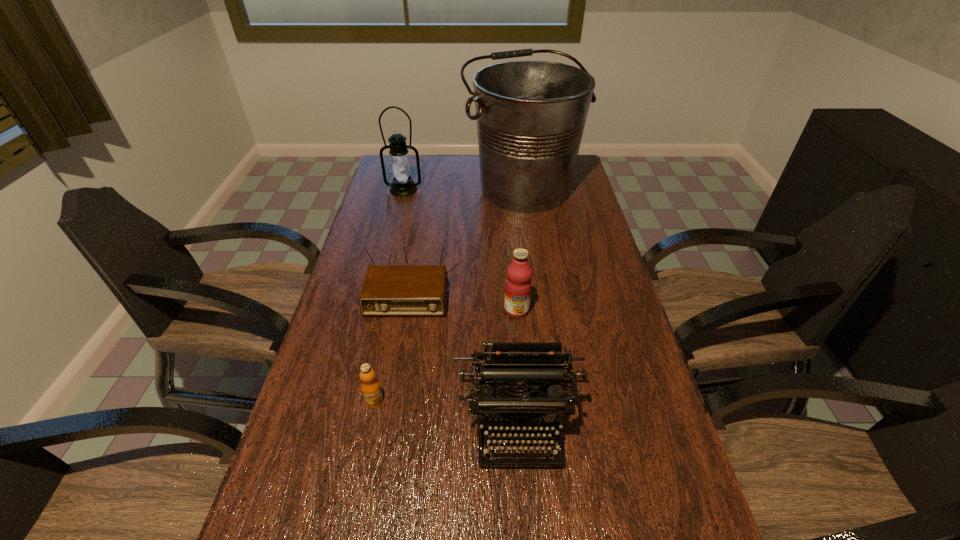
In the image, there is a desktop. Where is `free region at the far edge`? free region at the far edge is located at coordinates (438, 172).

Find the location of a particular element. free space at the left edge of the desktop is located at coordinates (366, 271).

Identify the location of blank area at the right edge. This screenshot has width=960, height=540. click(617, 318).

Where is `empty space between the radio_receiver and the fruit juice`? empty space between the radio_receiver and the fruit juice is located at coordinates (462, 297).

This screenshot has width=960, height=540. I want to click on free space between the second tallest object and the fruit juice, so click(x=460, y=249).

You are a GUI agent. You are given a task and a screenshot of the screen. Output one action in this format:
    pyautogui.click(x=<x>, y=<y>)
    Task: Click on the empty location between the shortest object and the radio_receiver
    
    Given the screenshot: What is the action you would take?
    (391, 342)

Find the location of a particular element. empty location between the radio_receiver and the orange juice is located at coordinates (391, 342).

Where is `vacant space in between the fruit juice and the radio_receiver`? Image resolution: width=960 pixels, height=540 pixels. vacant space in between the fruit juice and the radio_receiver is located at coordinates (462, 297).

This screenshot has height=540, width=960. Find the location of `free space between the orange juice and the fruit juice`. free space between the orange juice and the fruit juice is located at coordinates (445, 355).

At what (x,y) coordinates should I click in order to perform the action: click on vacant region between the typewriter and the lantern. Please return your answer as a coordinate pair (x, y). Looking at the image, I should click on (461, 306).